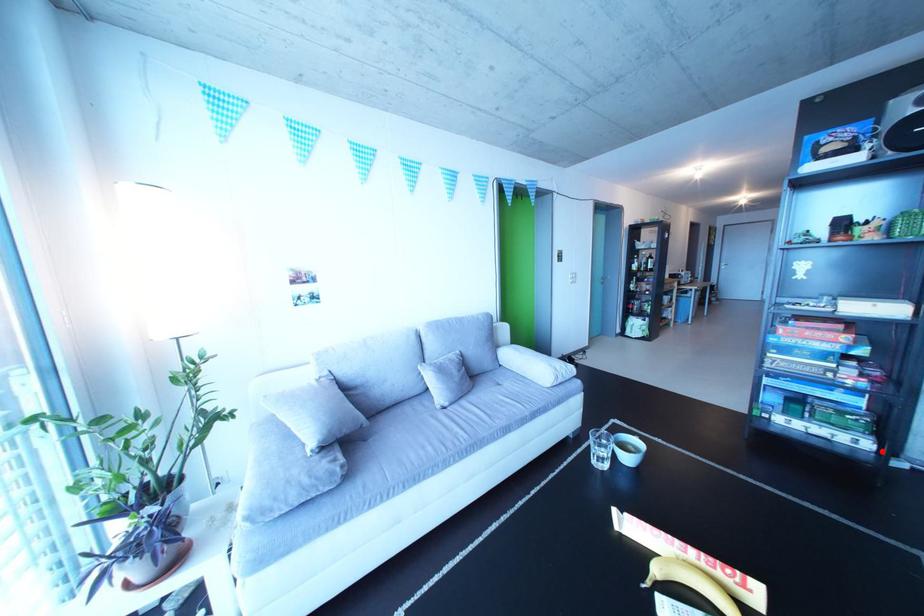
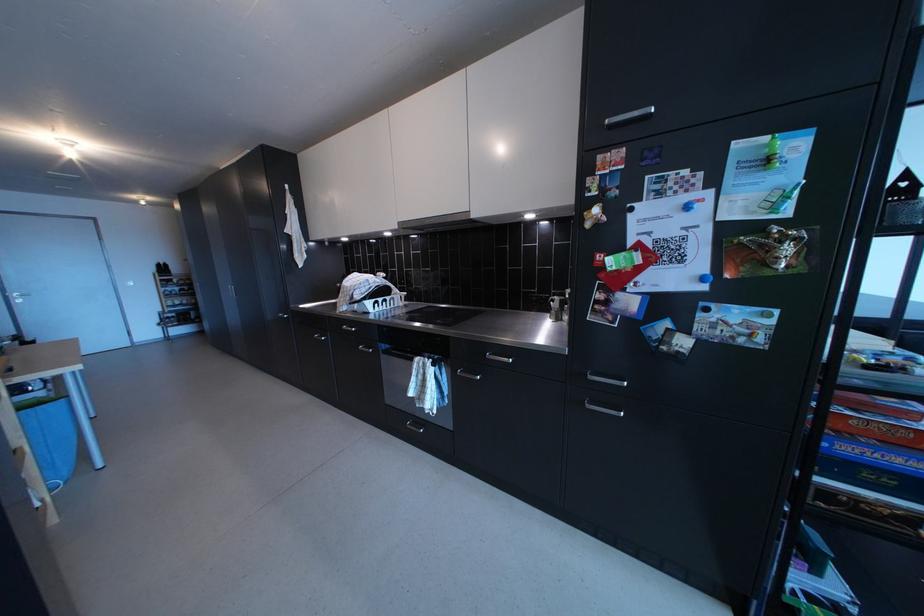
Question: I am providing you with two images of the same scene from different viewpoints. A red point is marked on the first image. Is the red point's position out of view in image 2?

Choices:
 (A) Yes
 (B) No

Answer: (A)